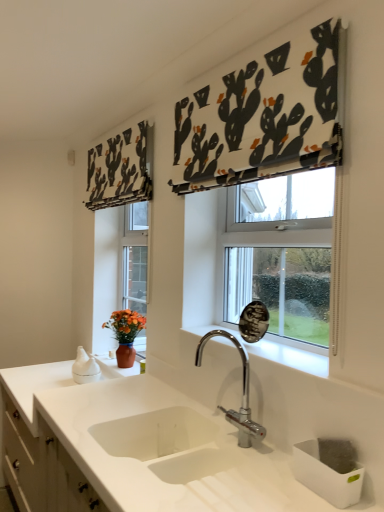
Question: Choose the correct answer: Is orange matte vase at left inside white glossy cabinet at lower left or outside it?

Choices:
 (A) outside
 (B) inside

Answer: (A)

Question: Is point (130, 350) positioned closer to the camera than point (64, 474)?

Choices:
 (A) farther
 (B) closer

Answer: (A)

Question: Estimate the real-world distances between objects in this image. Which object is closer to the white glossy sink at center?

Choices:
 (A) white fabric with cactus print at upper center, marked as the 1th curtain in a front-to-back arrangement
 (B) black fabric cactus-patterned curtain at upper left, which is the second curtain from right to left
 (C) chrome metallic faucet at center
 (D) orange matte vase at left
 (E) white glossy cabinet at lower left

Answer: (C)

Question: Considering the real-world distances, which object is farthest from the chrome metallic faucet at center?

Choices:
 (A) white glossy sink at center
 (B) white fabric with cactus print at upper center, the 1th curtain from the right
 (C) white glossy cabinet at lower left
 (D) black fabric cactus-patterned curtain at upper left, arranged as the second curtain when viewed from the front
 (E) orange matte vase at left

Answer: (D)